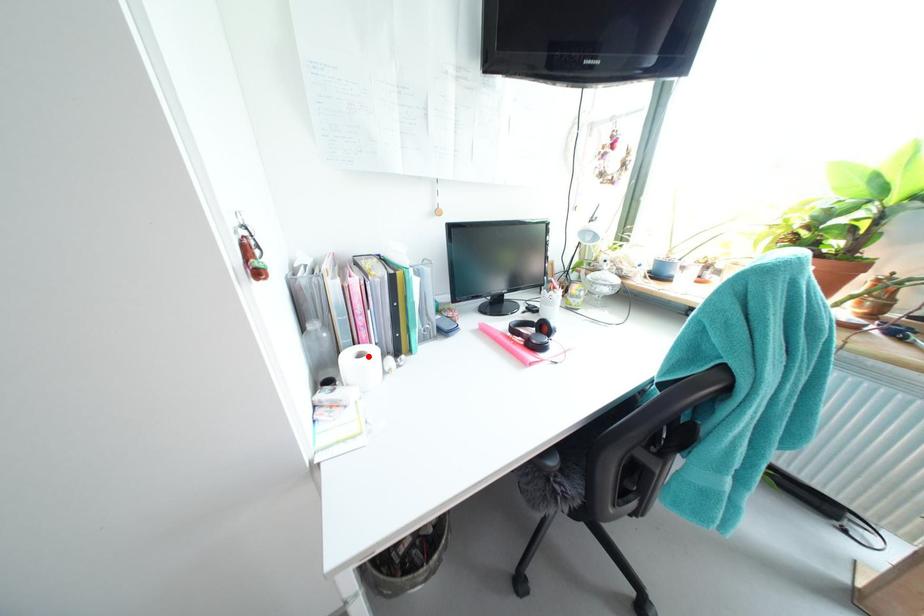
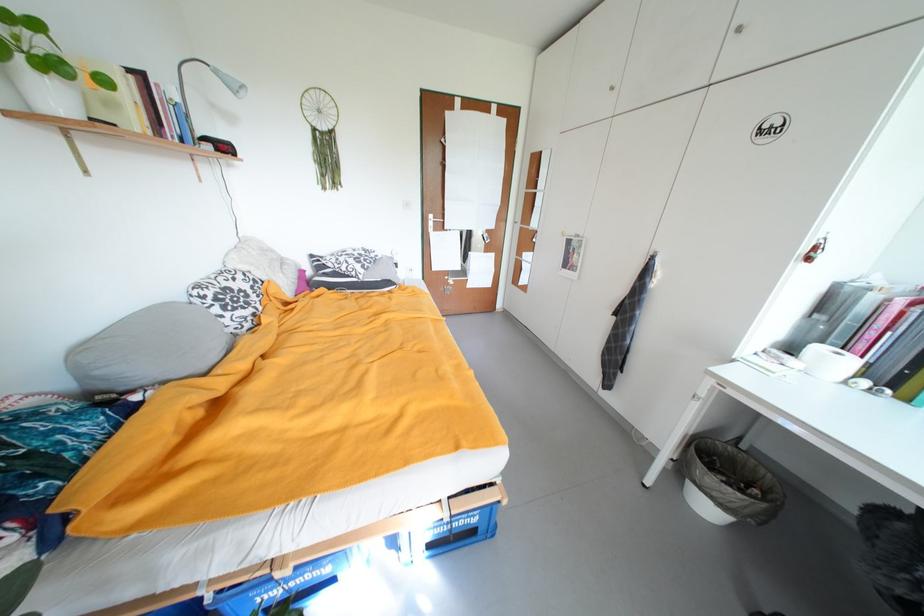
Question: I am providing you with two images of the same scene from different viewpoints. A red point is marked on the first image. Is the red point's position out of view in image 2?

Choices:
 (A) Yes
 (B) No

Answer: (B)